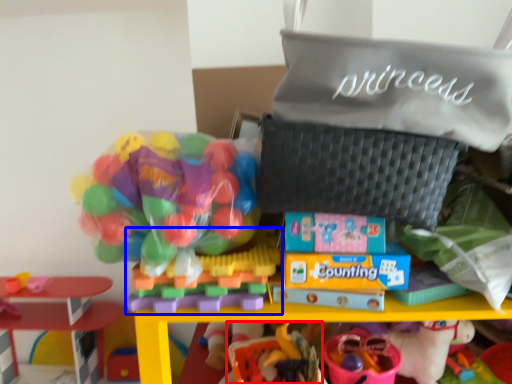
Question: Which object is closer to the camera taking this photo, toy (highlighted by a red box) or toy (highlighted by a blue box)?

Choices:
 (A) toy
 (B) toy

Answer: (B)